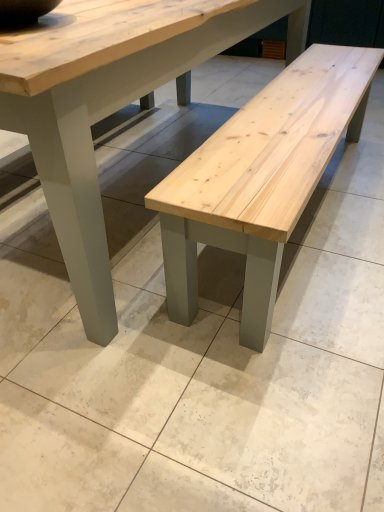
Locate an element on the screen. natural wood table at center is located at coordinates (110, 103).

What do you see at coordinates (110, 103) in the screenshot?
I see `natural wood table at center` at bounding box center [110, 103].

What is the approximate width of natural wood table at center?

natural wood table at center is 7.18 feet in width.

Where is `natural wood table at center`? This screenshot has height=512, width=384. natural wood table at center is located at coordinates tap(110, 103).